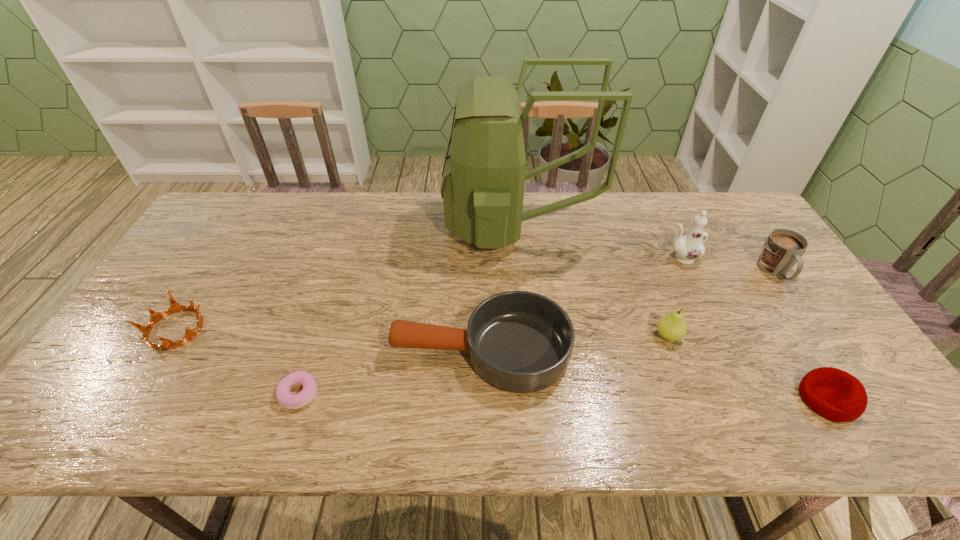
In order to click on vacant point located between the backpack and the sixth object from left to right in this screenshot , I will do 599,241.

I want to click on vacant space that is in between the backpack and the mug, so click(646, 248).

Identify the location of blank region between the pear and the mug. [722, 303].

Locate an element on the screen. This screenshot has height=540, width=960. free space between the second tallest object and the pan is located at coordinates (581, 304).

Select which object appears as the fourth closest to the mug. Please provide its 2D coordinates. Your answer should be formatted as a tuple, i.e. [(x, y)], where the tuple contains the x and y coordinates of a point satisfying the conditions above.

[(483, 178)]

Identify which object is the sixth nearest to the pear. Please provide its 2D coordinates. Your answer should be formatted as a tuple, i.e. [(x, y)], where the tuple contains the x and y coordinates of a point satisfying the conditions above.

[(307, 394)]